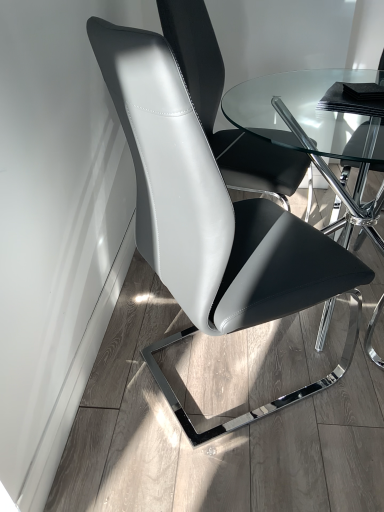
Image resolution: width=384 pixels, height=512 pixels. What are the coordinates of `vacant area situated below matte black chair at center, the 1th chair when ordered from front to back (from a real-world perspective)` in the screenshot? It's located at (213, 378).